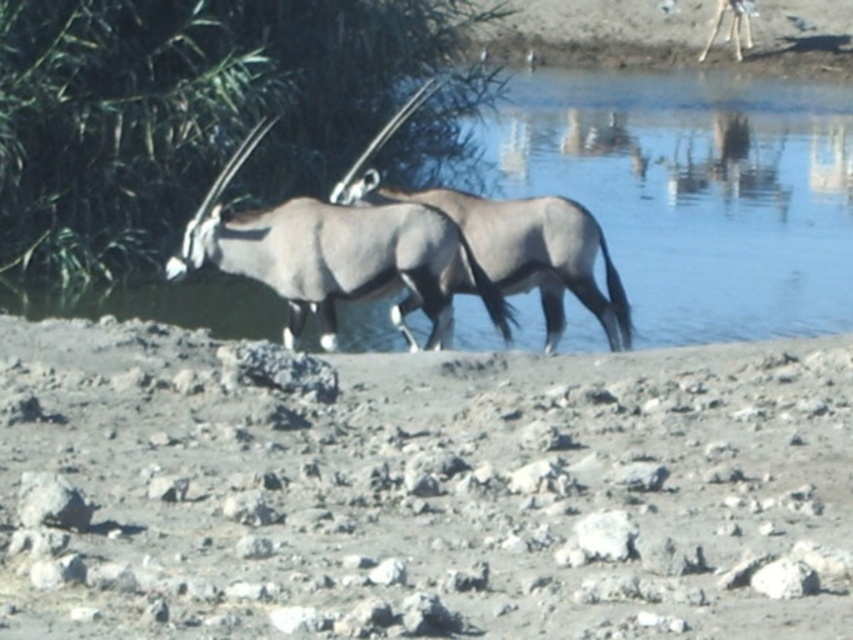
Question: In this image, where is clear blue water at center located relative to gray matte antelope at center?

Choices:
 (A) above
 (B) below

Answer: (A)

Question: Can you confirm if clear blue water at center is positioned below gray matte antelope at center?

Choices:
 (A) yes
 (B) no

Answer: (B)

Question: Does clear blue water at center have a smaller size compared to grayish-brown fur antelope at center?

Choices:
 (A) no
 (B) yes

Answer: (A)

Question: Which point is closer to the camera?

Choices:
 (A) grayish-brown fur antelope at center
 (B) gray matte antelope at center
 (C) clear blue water at center

Answer: (A)

Question: Which of the following is the closest to the observer?

Choices:
 (A) (271, 211)
 (B) (62, 314)

Answer: (A)

Question: Which object appears farthest from the camera in this image?

Choices:
 (A) grayish-brown fur antelope at center
 (B) clear blue water at center
 (C) gray matte antelope at center

Answer: (B)